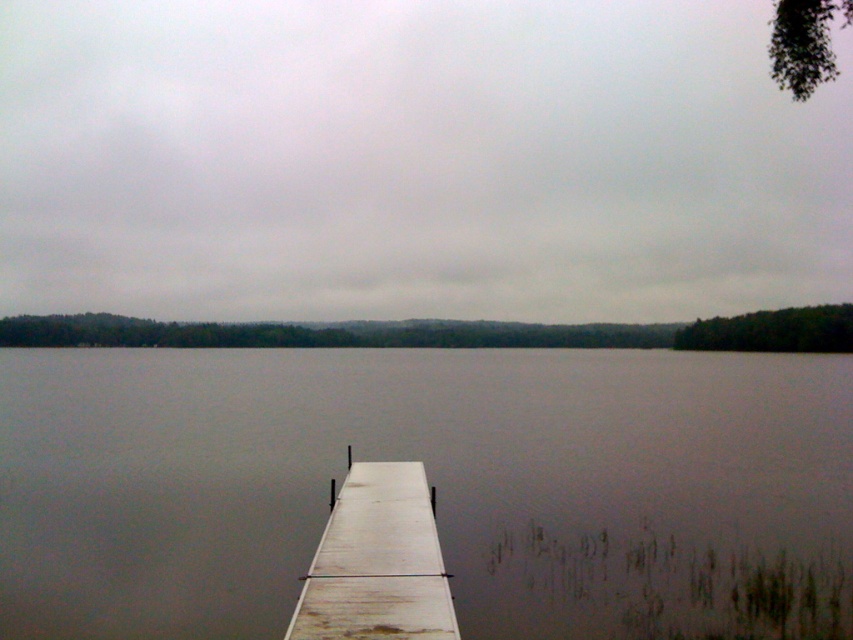
From the picture: You are standing at the edge of the lakeside and want to walk towards the point labeled as point (434, 525). There is another point marked as point (256, 576) in your path. Which point will you encounter first?

You will encounter point (256, 576) first because it is located in front of point (434, 525) along your path towards the latter.

You are standing at the edge of the lakeside and want to reach the point marked as point (619, 515). If your walking speed is 1.5 meters per second, how many seconds will it take you to reach that point?

The distance between you and point (619, 515) is 17.73 meters. At a walking speed of 1.5 meters per second, it will take approximately 11.82 seconds to reach the point. Since the question asks for seconds, rounding to the nearest whole number gives about 12 seconds.

You are standing on the white wood dock at lower center and want to look towards the smooth gray water at center. In which direction should you turn your head?

You should turn your head to the right because the smooth gray water at center is located to the right of the white wood dock at lower center.